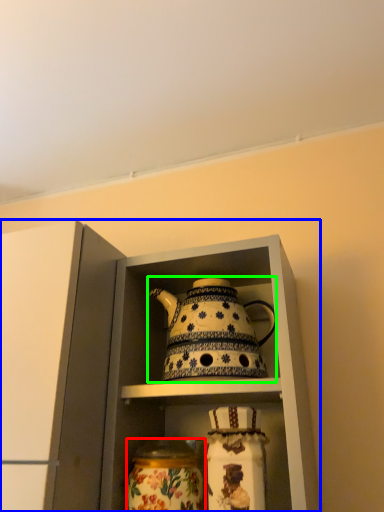
Question: Which is farther away from glass vase (highlighted by a red box)? cabinetry (highlighted by a blue box) or kettle (highlighted by a green box)?

Choices:
 (A) cabinetry
 (B) kettle

Answer: (A)